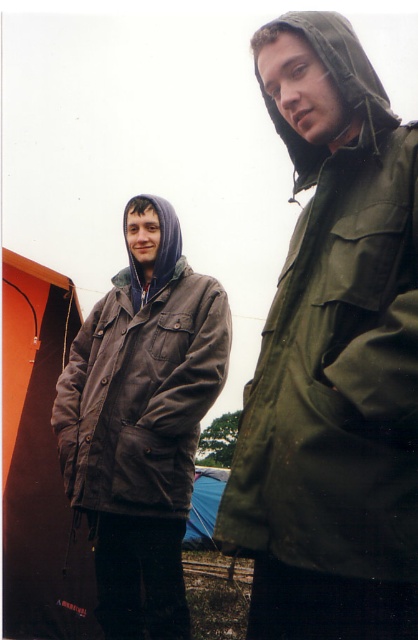
You are planning to take a photo of the brown leather jacket at left and the blue fabric tent at lower center. Which object should you focus on first if you want to capture both in the same frame without moving the camera?

The brown leather jacket at left is much taller than the blue fabric tent at lower center, so you should focus on the brown leather jacket at left first to ensure it fits within the frame.